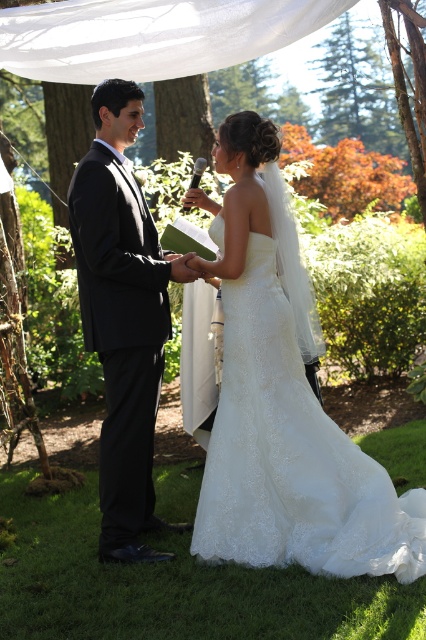
You are a photographer at the wedding ceremony. You need to capture a closeup shot of the bride wearing the white lace dress at center and the white lace wedding dress at center. Which dress should you focus on to ensure it fits within the frame without cropping?

The white lace dress at center is wider than the white lace wedding dress at center, so focusing on the white lace wedding dress at center will ensure it fits within the frame without cropping.

Based on the scene description, which object is shorter in height between the white lace dress at center and the black satin suit at left?

The white lace dress at center is shorter in height compared to the black satin suit at left.

You are a photographer at the wedding ceremony. You want to take a photo of the white lace dress at center. Where should you position your camera to capture the dress in the best possible way?

The white lace dress at center is located at point 0.625 on the x axis and 0.664 on the y axis. To capture it best, position the camera directly facing this coordinate for optimal framing.